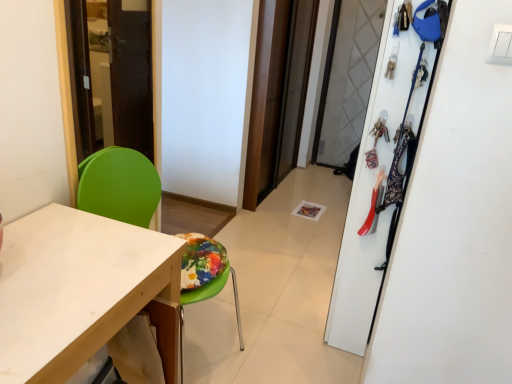
Question: Does white matte desk at lower left have a lesser height compared to transparent glass screen door at center?

Choices:
 (A) yes
 (B) no

Answer: (A)

Question: Would you say transparent glass screen door at center is part of white matte desk at lower left's contents?

Choices:
 (A) yes
 (B) no

Answer: (B)

Question: Does white matte desk at lower left have a larger size compared to transparent glass screen door at center?

Choices:
 (A) yes
 (B) no

Answer: (A)

Question: From a real-world perspective, is white matte desk at lower left over transparent glass screen door at center?

Choices:
 (A) yes
 (B) no

Answer: (B)

Question: Is white matte desk at lower left positioned far away from transparent glass screen door at center?

Choices:
 (A) yes
 (B) no

Answer: (A)

Question: From a real-world perspective, is white matte desk at lower left under transparent glass screen door at center?

Choices:
 (A) no
 (B) yes

Answer: (B)

Question: Is white matte closet at upper right next to white matte desk at lower left and touching it?

Choices:
 (A) yes
 (B) no

Answer: (B)

Question: Is white matte closet at upper right looking in the opposite direction of white matte desk at lower left?

Choices:
 (A) no
 (B) yes

Answer: (A)

Question: Is the depth of white matte closet at upper right greater than that of white matte desk at lower left?

Choices:
 (A) no
 (B) yes

Answer: (B)

Question: From a real-world perspective, is white matte closet at upper right positioned over white matte desk at lower left based on gravity?

Choices:
 (A) yes
 (B) no

Answer: (A)

Question: From the image's perspective, is white matte closet at upper right under white matte desk at lower left?

Choices:
 (A) yes
 (B) no

Answer: (B)

Question: Considering the relative positions of white matte closet at upper right and white matte desk at lower left in the image provided, is white matte closet at upper right to the left of white matte desk at lower left from the viewer's perspective?

Choices:
 (A) yes
 (B) no

Answer: (B)

Question: From the image's perspective, would you say white matte desk at lower left is shown under white matte closet at upper right?

Choices:
 (A) yes
 (B) no

Answer: (A)